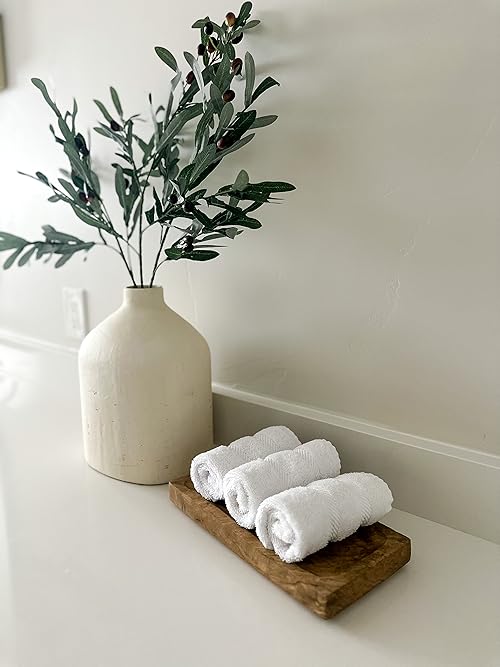
Locate an element on the screen. The image size is (500, 667). wall is located at coordinates (415, 398).